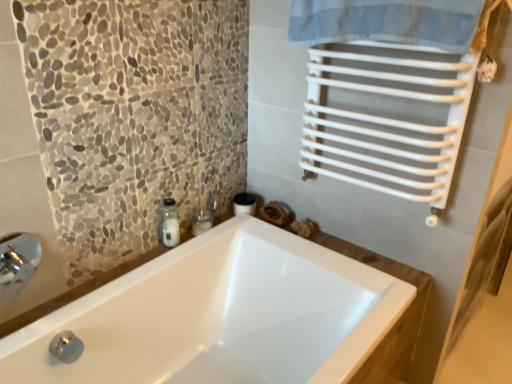
Measure the distance between point [228,315] and camera.

1.73 meters.

Describe the element at coordinates (201, 221) in the screenshot. Image resolution: width=512 pixels, height=384 pixels. I see `clear glass jar at center` at that location.

This screenshot has width=512, height=384. What do you see at coordinates (18, 261) in the screenshot?
I see `silver metallic faucet at lower left` at bounding box center [18, 261].

Where is `clear glass jar at upper left`? clear glass jar at upper left is located at coordinates (170, 223).

Image resolution: width=512 pixels, height=384 pixels. I want to click on white glossy bathtub at center, so click(223, 317).

Does clear glass jar at upper left turn towards white glossy bathtub at center?

No, clear glass jar at upper left is not oriented towards white glossy bathtub at center.

Is white glossy bathtub at center surrounded by clear glass jar at upper left?

Definitely not — white glossy bathtub at center is not inside clear glass jar at upper left.

Between clear glass jar at upper left and white glossy bathtub at center, which one has larger width?

Wider between the two is white glossy bathtub at center.

Is the surface of clear glass jar at upper left in direct contact with white glossy bathtub at center?

No, clear glass jar at upper left is not with white glossy bathtub at center.

Does clear glass jar at center touch white glossy bathtub at center?

clear glass jar at center and white glossy bathtub at center are not in contact.

Would you say white glossy bathtub at center is part of clear glass jar at center's contents?

No, white glossy bathtub at center is located outside of clear glass jar at center.

Considering the relative positions of clear glass jar at center and white glossy bathtub at center in the image provided, is clear glass jar at center behind white glossy bathtub at center?

Yes, the depth of clear glass jar at center is greater than that of white glossy bathtub at center.

Can you confirm if clear glass jar at center is smaller than white glossy bathtub at center?

Yes, clear glass jar at center is smaller than white glossy bathtub at center.

Where is `faucet that appears below the clear glass jar at upper left (from the image's perspective)`? faucet that appears below the clear glass jar at upper left (from the image's perspective) is located at coordinates (18, 261).

Is silver metallic faucet at lower left facing away from clear glass jar at upper left?

No, silver metallic faucet at lower left is not facing away from clear glass jar at upper left.

Considering the sizes of objects silver metallic faucet at lower left and clear glass jar at upper left in the image provided, who is wider, silver metallic faucet at lower left or clear glass jar at upper left?

Wider between the two is silver metallic faucet at lower left.

From a real-world perspective, between clear glass jar at upper left and clear glass jar at center, who is vertically higher?

clear glass jar at upper left.

Is clear glass jar at upper left aimed at clear glass jar at center?

No, clear glass jar at upper left does not turn towards clear glass jar at center.

Between clear glass jar at upper left and clear glass jar at center, which one has smaller size?

clear glass jar at upper left.

Which is less distant, (135, 336) or (172, 240)?

Point (135, 336) is positioned closer to the camera compared to point (172, 240).

Is white glossy bathtub at center not within clear glass jar at upper left?

Indeed, white glossy bathtub at center is completely outside clear glass jar at upper left.

Is white glossy bathtub at center next to clear glass jar at upper left and touching it?

No, white glossy bathtub at center is not beside clear glass jar at upper left.

What's the angular difference between white glossy bathtub at center and clear glass jar at upper left's facing directions?

6.5 degrees.

This screenshot has width=512, height=384. Find the location of `faucet to the left of clear glass jar at center`. faucet to the left of clear glass jar at center is located at coordinates (18, 261).

Which is more distant, [199,226] or [17,235]?

The point [199,226] is farther.

Consider the image. How distant is clear glass jar at center from silver metallic faucet at lower left?

They are 66.29 centimeters apart.

Can you tell me how much clear glass jar at center and silver metallic faucet at lower left differ in facing direction?

clear glass jar at center and silver metallic faucet at lower left are facing 3.29 degrees away from each other.

Does clear glass jar at upper left have a larger size compared to silver metallic faucet at lower left?

Incorrect, clear glass jar at upper left is not larger than silver metallic faucet at lower left.

You are a GUI agent. You are given a task and a screenshot of the screen. Output one action in this format:
    pyautogui.click(x=<x>, y=<y>)
    Task: Click on the faucet that appears above the clear glass jar at upper left (from a real-world perspective)
    Image resolution: width=512 pixels, height=384 pixels.
    Given the screenshot: What is the action you would take?
    pyautogui.click(x=18, y=261)

From a real-world perspective, is clear glass jar at upper left positioned above or below silver metallic faucet at lower left?

From a real-world perspective, clear glass jar at upper left is physically below silver metallic faucet at lower left.

How far apart are clear glass jar at upper left and silver metallic faucet at lower left?

19.98 inches.

The height and width of the screenshot is (384, 512). In order to click on soap dispenser above the white glossy bathtub at center (from the image's perspective) in this screenshot , I will do `click(170, 223)`.

What are the coordinates of `toiletry that appears behind the white glossy bathtub at center` in the screenshot? It's located at (201, 221).

Looking at the image, which one is located further to white glossy bathtub at center, clear glass jar at upper left or silver metallic faucet at lower left?

Among the two, silver metallic faucet at lower left is located further to white glossy bathtub at center.

Considering their positions, is clear glass jar at center positioned further to silver metallic faucet at lower left than clear glass jar at upper left?

Among the two, clear glass jar at center is located further to silver metallic faucet at lower left.

From the image, which object appears to be farther from white glossy bathtub at center, silver metallic faucet at lower left or clear glass jar at upper left?

The object further to white glossy bathtub at center is silver metallic faucet at lower left.

Which object lies nearer to the anchor point silver metallic faucet at lower left, white glossy bathtub at center or clear glass jar at center?

white glossy bathtub at center lies closer to silver metallic faucet at lower left than the other object.

Based on their spatial positions, is clear glass jar at upper left or clear glass jar at center closer to white glossy bathtub at center?

clear glass jar at upper left is positioned closer to the anchor white glossy bathtub at center.

From the image, which object appears to be nearer to clear glass jar at center, silver metallic faucet at lower left or white glossy bathtub at center?

Among the two, white glossy bathtub at center is located nearer to clear glass jar at center.

Consider the image. Considering their positions, is clear glass jar at center positioned further to silver metallic faucet at lower left than white glossy bathtub at center?

The object further to silver metallic faucet at lower left is clear glass jar at center.

Which object lies nearer to the anchor point silver metallic faucet at lower left, clear glass jar at upper left or clear glass jar at center?

clear glass jar at upper left lies closer to silver metallic faucet at lower left than the other object.

At what (x,y) coordinates should I click in order to perform the action: click on soap dispenser between white glossy bathtub at center and clear glass jar at center from front to back. Please return your answer as a coordinate pair (x, y). The width and height of the screenshot is (512, 384). Looking at the image, I should click on (170, 223).

In order to click on soap dispenser located between silver metallic faucet at lower left and clear glass jar at center in the depth direction in this screenshot , I will do `click(170, 223)`.

This screenshot has height=384, width=512. Identify the location of faucet between white glossy bathtub at center and clear glass jar at center along the z-axis. (18, 261).

Locate an element on the screen. Image resolution: width=512 pixels, height=384 pixels. faucet positioned between white glossy bathtub at center and clear glass jar at upper left from near to far is located at coordinates (18, 261).